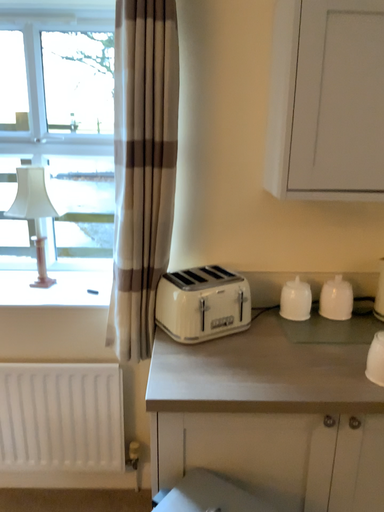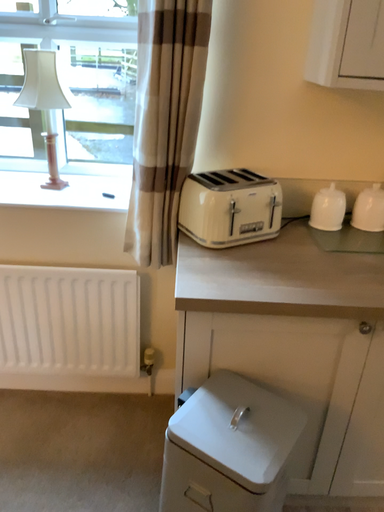
Question: Which way did the camera rotate in the video?

Choices:
 (A) rotated downward
 (B) rotated upward

Answer: (A)